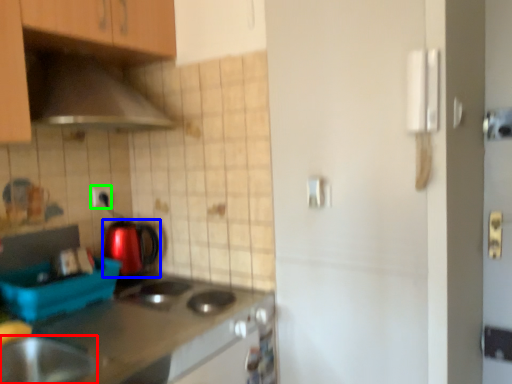
Question: Which object is the farthest from home appliance (highlighted by a red box)? Choose among these: kitchen appliance (highlighted by a blue box) or electric outlet (highlighted by a green box).

Choices:
 (A) kitchen appliance
 (B) electric outlet

Answer: (B)